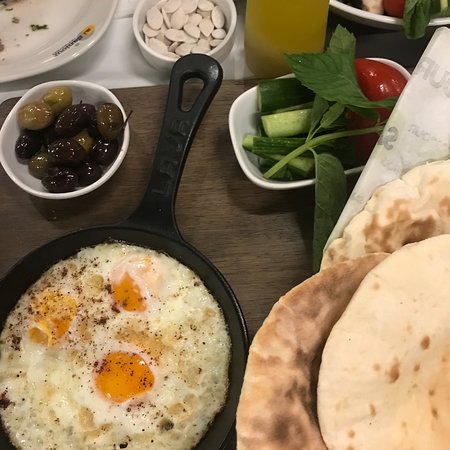
The height and width of the screenshot is (450, 450). What are the coordinates of `plate` in the screenshot? It's located at (79, 52).